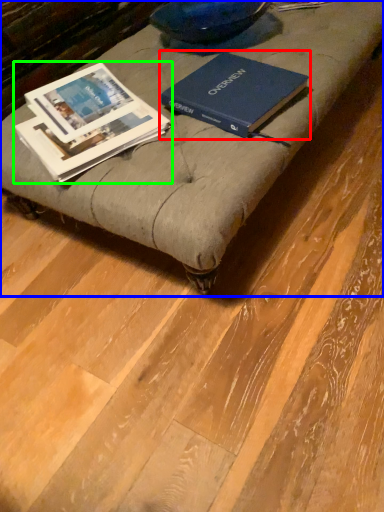
Question: Which object is the farthest from book (highlighted by a red box)? Choose among these: furniture (highlighted by a blue box) or book (highlighted by a green box).

Choices:
 (A) furniture
 (B) book

Answer: (B)